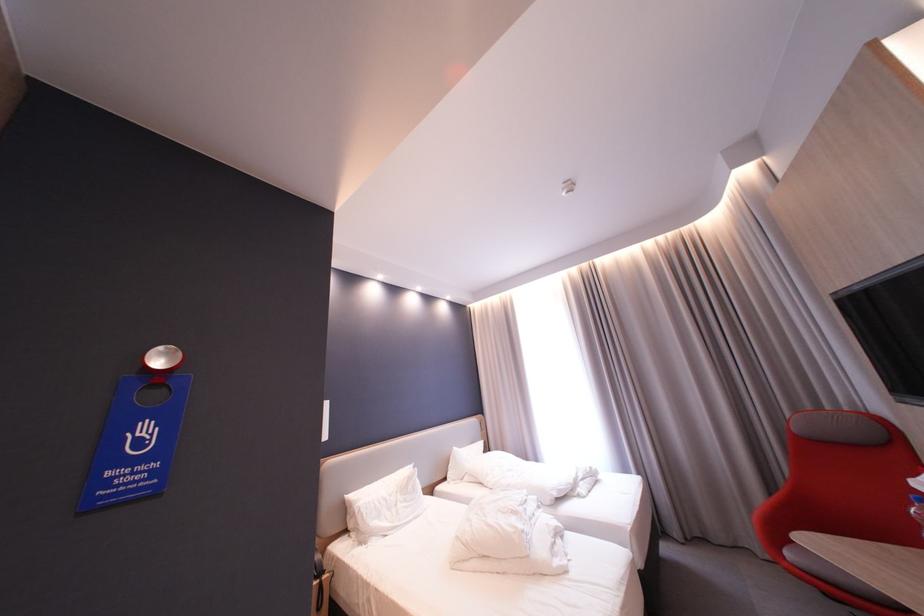
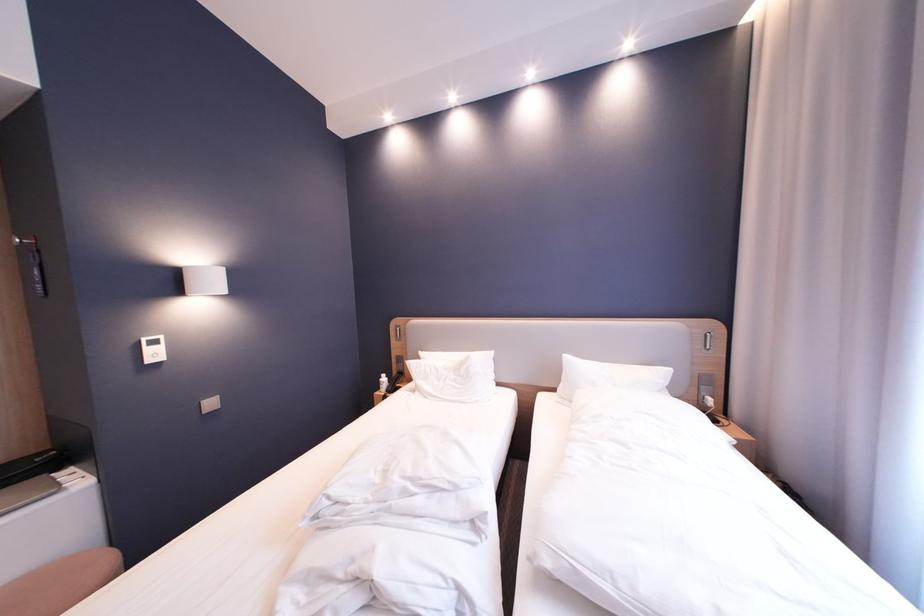
Locate, in the second image, the point that corresponds to the point at 400,512 in the first image.

(450, 382)